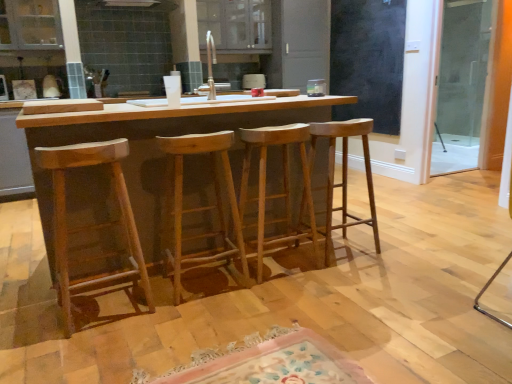
Find the location of a particular element. The width and height of the screenshot is (512, 384). vacant area situated below natural wood stool at center, placed as the 2th stool when sorted from left to right (from a real-world perspective) is located at coordinates (206, 284).